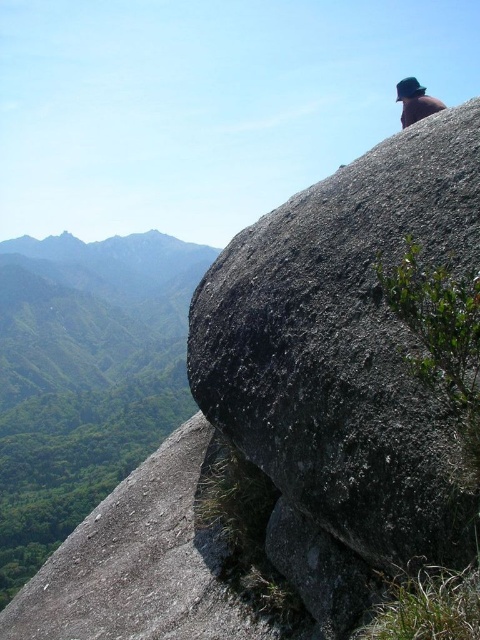
Is gray rough boulder at upper right closer to the viewer compared to green felt hat at upper right?

Yes, it is in front of green felt hat at upper right.

Who is more forward, (274, 442) or (420, 116)?

Point (274, 442) is in front.

The width and height of the screenshot is (480, 640). Describe the element at coordinates (346, 346) in the screenshot. I see `gray rough boulder at upper right` at that location.

The width and height of the screenshot is (480, 640). I want to click on gray rough boulder at upper right, so click(346, 346).